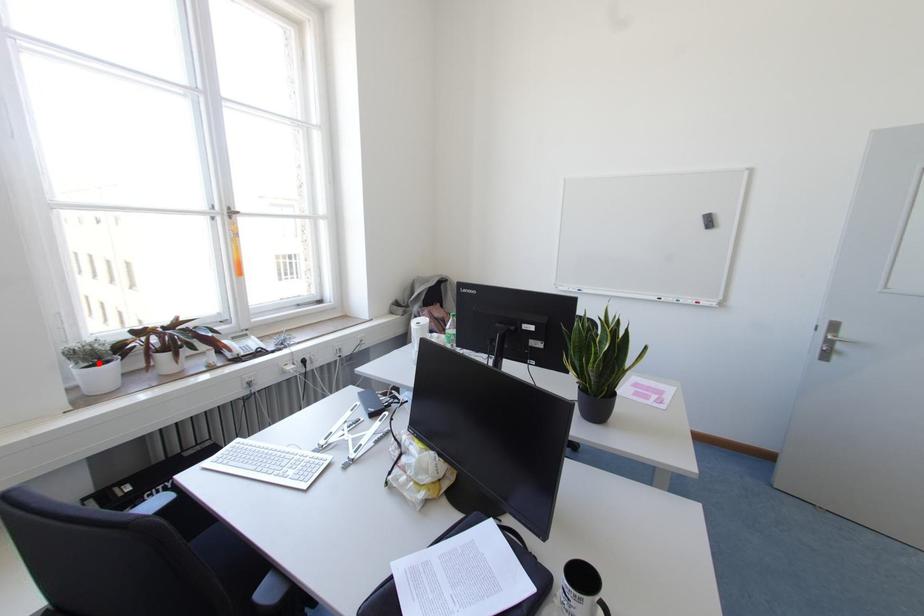
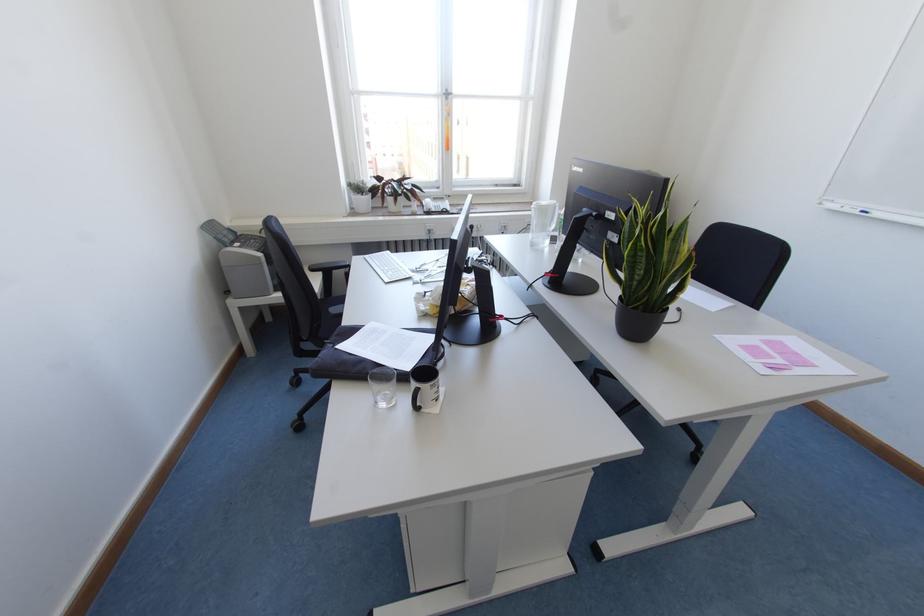
Locate, in the second image, the point that corresponds to the highlighted location in the first image.

(361, 195)